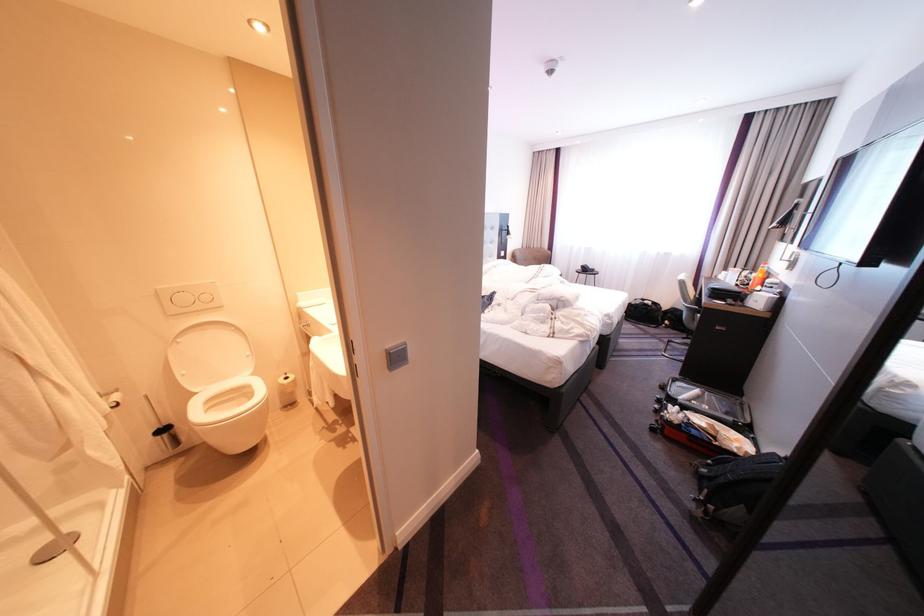
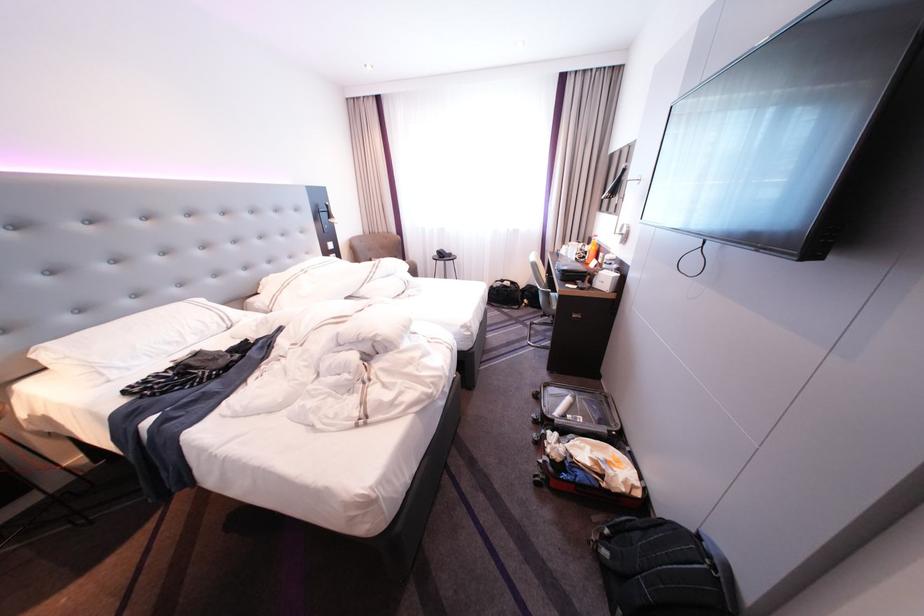
Find the pixel in the second image that matches pixel 759 273 in the first image.

(593, 245)